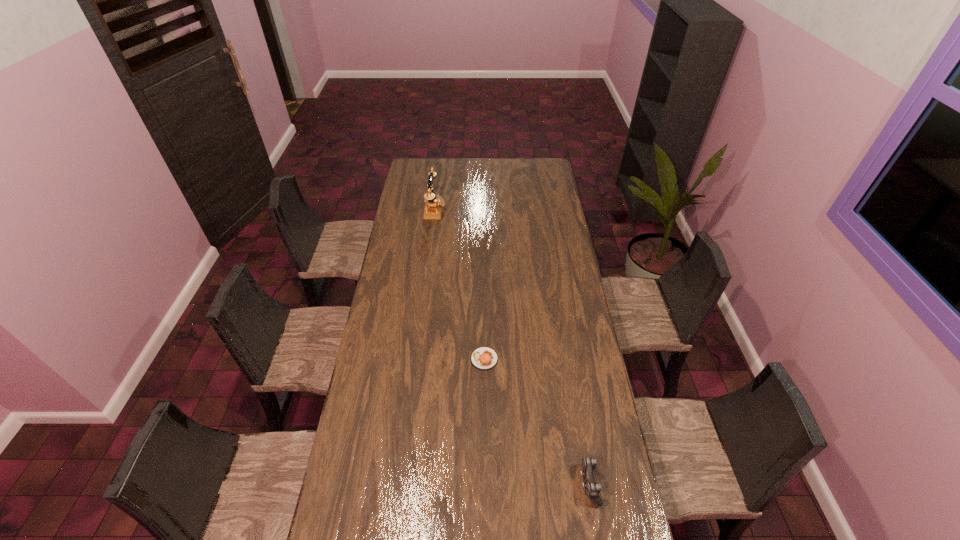
Locate an element on the screen. This screenshot has width=960, height=540. the leftmost object is located at coordinates (433, 206).

Where is `the farthest object`? The height and width of the screenshot is (540, 960). the farthest object is located at coordinates (433, 206).

Where is `the second shortest object`? The image size is (960, 540). the second shortest object is located at coordinates (592, 488).

The image size is (960, 540). Find the location of `the rightmost object`. the rightmost object is located at coordinates (592, 488).

What are the coordinates of `the second farthest object` in the screenshot? It's located at (484, 358).

The height and width of the screenshot is (540, 960). In order to click on the second object from right to left in this screenshot , I will do [x=484, y=358].

Find the location of `vacant region located 0.230m on the dial of the tallest object`. vacant region located 0.230m on the dial of the tallest object is located at coordinates (486, 210).

Where is `vacant space located 0.370m on the surface of the rightmost object with buttons`? vacant space located 0.370m on the surface of the rightmost object with buttons is located at coordinates (466, 484).

In order to click on vacant space located on the surface of the rightmost object with buttons in this screenshot , I will do `click(502, 484)`.

Locate an element on the screen. vacant area located 0.360m on the surface of the rightmost object with buttons is located at coordinates (468, 484).